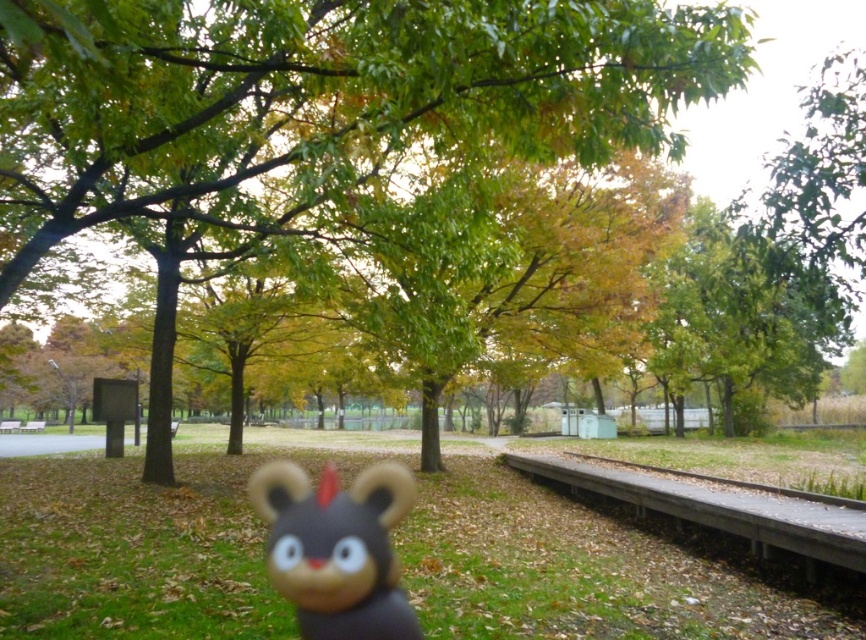
Between brown wooden bench at center and wooden park bench at center, which one appears on the left side from the viewer's perspective?

Positioned to the left is brown wooden bench at center.

I want to click on brown wooden bench at center, so [x=10, y=426].

Where is `brown wooden bench at center`? The image size is (866, 640). brown wooden bench at center is located at coordinates (10, 426).

Is fuzzy brown plush toy at center bigger than brown wooden bench at center?

Yes.

Between fuzzy brown plush toy at center and brown wooden bench at center, which one has more height?

fuzzy brown plush toy at center is taller.

The image size is (866, 640). In order to click on fuzzy brown plush toy at center in this screenshot , I will do `click(335, 548)`.

Where is `fuzzy brown plush toy at center`? The image size is (866, 640). fuzzy brown plush toy at center is located at coordinates (335, 548).

Does green leafy tree at center appear over fuzzy brown plush toy at center?

Yes.

Is green leafy tree at center below fuzzy brown plush toy at center?

No.

Measure the distance between point (31, 156) and camera.

Point (31, 156) is 11.98 meters from camera.

This screenshot has width=866, height=640. Identify the location of green leafy tree at center. (320, 104).